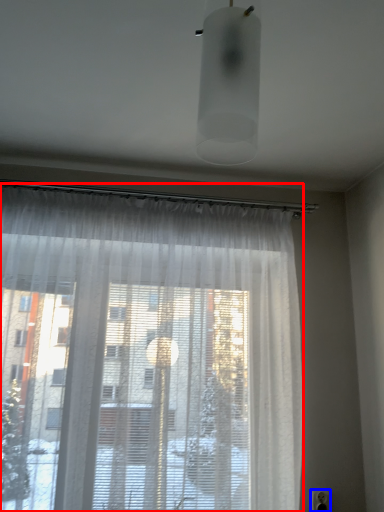
Question: Which point is closer to the camera, curtain (highlighted by a red box) or electric outlet (highlighted by a blue box)?

Choices:
 (A) curtain
 (B) electric outlet

Answer: (A)